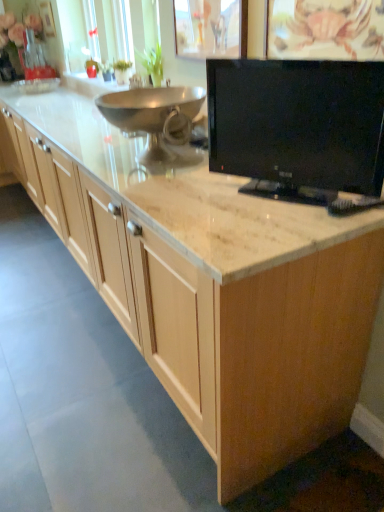
At what (x,y) coordinates should I click in order to perform the action: click on free area below black glossy tv at upper right (from a real-world perspective). Please return your answer as a coordinate pair (x, y). The image size is (384, 512). Looking at the image, I should click on (281, 200).